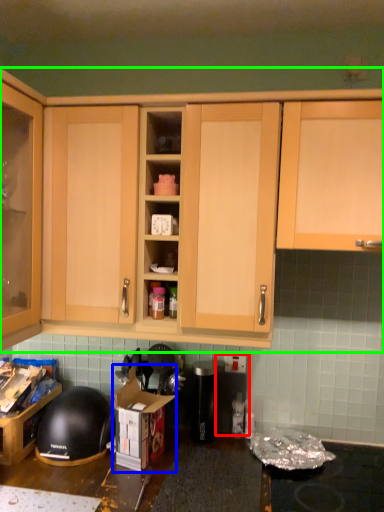
Question: Which object is the closest to the appliance (highlighted by a red box)? Choose among these: cardboard box (highlighted by a blue box) or cabinetry (highlighted by a green box).

Choices:
 (A) cardboard box
 (B) cabinetry

Answer: (A)